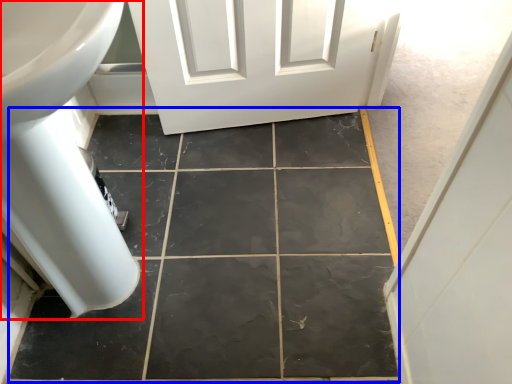
Question: Which of the following is the closest to the observer, bath (highlighted by a red box) or ceramic tile (highlighted by a blue box)?

Choices:
 (A) bath
 (B) ceramic tile

Answer: (A)